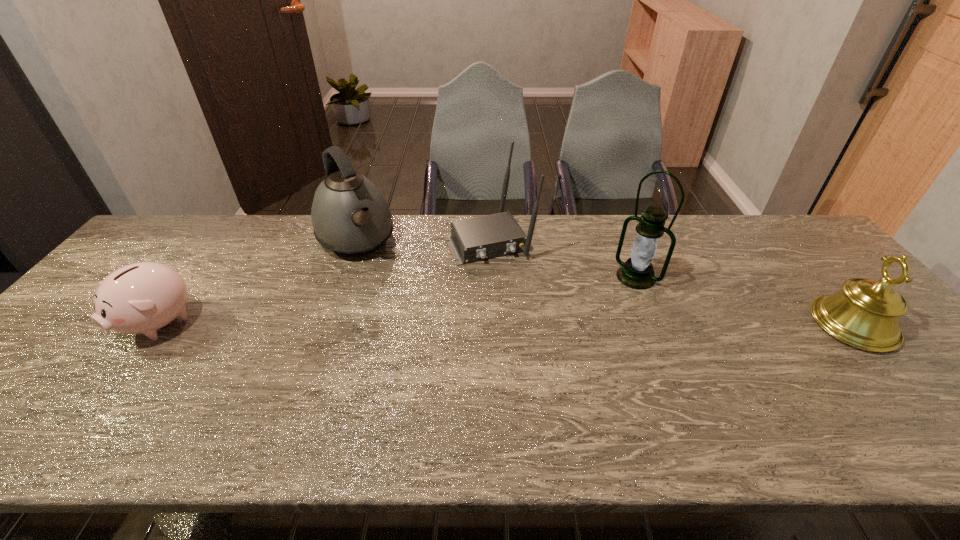
At what (x,y) coordinates should I click in order to perform the action: click on vacant area situated 0.320m on the side where the fourth object from left to right emits light. Please return your answer as a coordinate pair (x, y). This screenshot has width=960, height=540. Looking at the image, I should click on (561, 352).

Image resolution: width=960 pixels, height=540 pixels. Find the location of `free region located on the side where the fourth object from left to right emits light`. free region located on the side where the fourth object from left to right emits light is located at coordinates (589, 322).

Locate an element on the screen. The image size is (960, 540). free region located on the back of the router to connect cables is located at coordinates (516, 284).

Locate an element on the screen. Image resolution: width=960 pixels, height=540 pixels. vacant space situated on the back of the router to connect cables is located at coordinates (534, 315).

Locate an element on the screen. The image size is (960, 540). vacant area situated 0.130m on the back of the router to connect cables is located at coordinates (520, 293).

Image resolution: width=960 pixels, height=540 pixels. I want to click on free location located at the spout of the kettle, so click(423, 360).

Where is `free location located at the spout of the kettle`? This screenshot has width=960, height=540. free location located at the spout of the kettle is located at coordinates (394, 310).

Image resolution: width=960 pixels, height=540 pixels. In order to click on vacant region located 0.120m at the spout of the kettle in this screenshot , I will do `click(381, 291)`.

Identify the location of router located at the far edge. The height and width of the screenshot is (540, 960). (474, 239).

Identify the location of kettle located in the far edge section of the desktop. Image resolution: width=960 pixels, height=540 pixels. (350, 216).